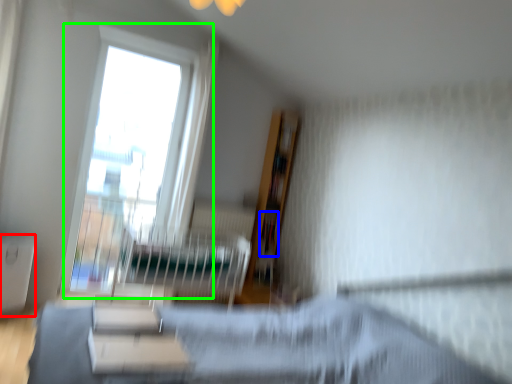
Question: Which is nearer to the table (highlighted by a red box)? book (highlighted by a blue box) or window (highlighted by a green box).

Choices:
 (A) book
 (B) window

Answer: (B)